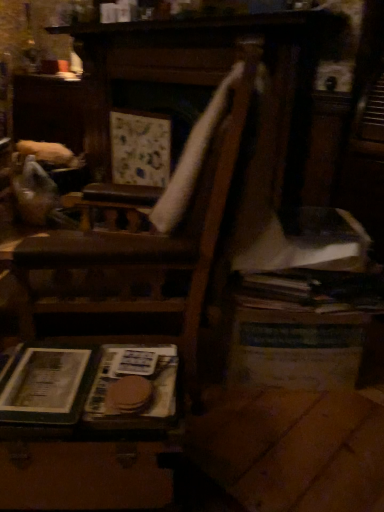
Question: Looking at their shapes, would you say hardcover book at lower left, acting as the first paperback book starting from the left, is wider or thinner than wooden table at lower right, arranged as the first table when viewed from the right?

Choices:
 (A) wide
 (B) thin

Answer: (B)

Question: Is point (46, 354) positioned closer to the camera than point (326, 317)?

Choices:
 (A) farther
 (B) closer

Answer: (B)

Question: Which object is the closest to the brown paper at lower left, the first paperback book positioned from the right?

Choices:
 (A) wooden table at lower right, the second table when ordered from left to right
 (B) hardcover book at lower left, which appears as the second paperback book when viewed from the right
 (C) wooden suitcase at lower left, the second table from the right

Answer: (C)

Question: Considering the real-world distances, which object is farthest from the wooden suitcase at lower left, the second table from the right?

Choices:
 (A) wooden table at lower right, the second table viewed from the front
 (B) brown paper at lower left, the first paperback book positioned from the right
 (C) hardcover book at lower left, acting as the first paperback book starting from the left

Answer: (A)